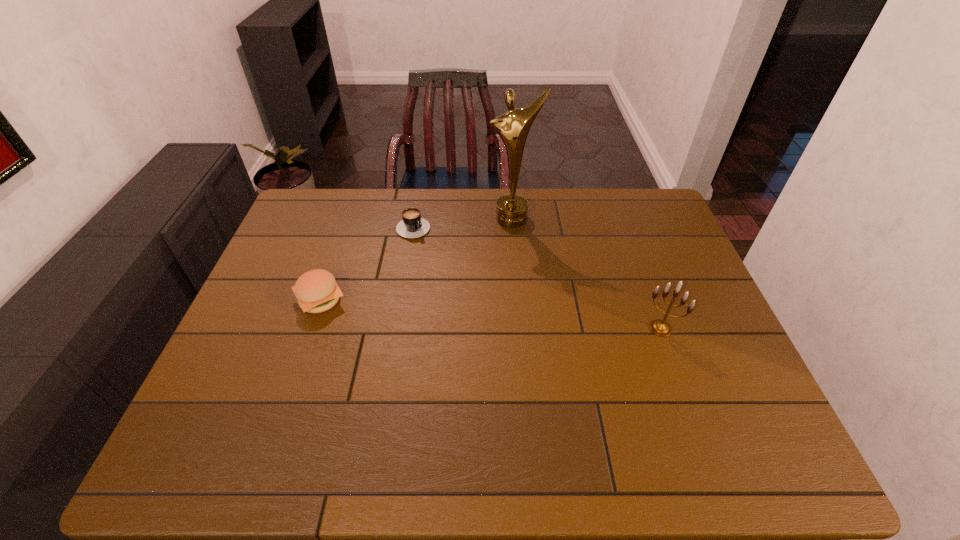
Where is `free area in between the leftmost object and the second object from right to left`? free area in between the leftmost object and the second object from right to left is located at coordinates (417, 259).

The height and width of the screenshot is (540, 960). Identify the location of free space that is in between the shortest object and the candelabrum. (538, 276).

Locate an element on the screen. Image resolution: width=960 pixels, height=540 pixels. vacant area that lies between the second tallest object and the shortest object is located at coordinates (538, 276).

Locate an element on the screen. Image resolution: width=960 pixels, height=540 pixels. free space between the hamburger and the tallest object is located at coordinates (417, 259).

The height and width of the screenshot is (540, 960). I want to click on free space between the leftmost object and the cappuccino, so click(368, 262).

The width and height of the screenshot is (960, 540). Identify the location of object that stands as the third closest to the second shortest object. (661, 328).

Where is `object that stands as the closest to the hamburger`? This screenshot has width=960, height=540. object that stands as the closest to the hamburger is located at coordinates (412, 226).

Where is `free spot that satisfies the following two spatial constraints: 1. on the front side of the shortest object; 2. on the left side of the second tallest object`? free spot that satisfies the following two spatial constraints: 1. on the front side of the shortest object; 2. on the left side of the second tallest object is located at coordinates click(396, 328).